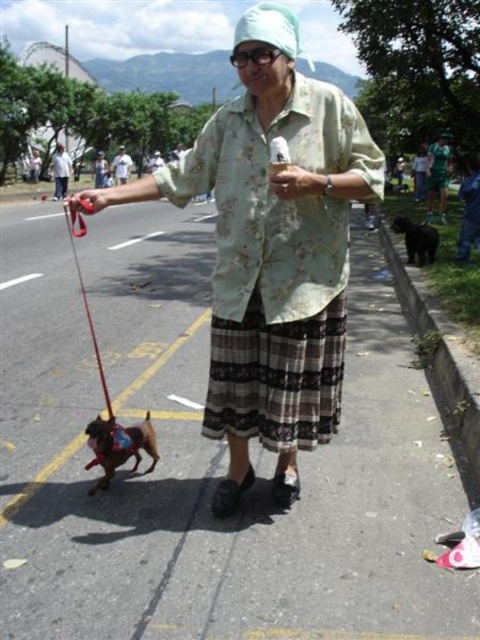
Question: Does smooth asphalt road at center lie behind black fur dog at right?

Choices:
 (A) yes
 (B) no

Answer: (B)

Question: From the image, what is the correct spatial relationship of black fur dog at right in relation to rubber leash at left?

Choices:
 (A) left
 (B) right

Answer: (B)

Question: Which object appears closest to the camera in this image?

Choices:
 (A) floral fabric shirt at center
 (B) plaid fabric skirt at center

Answer: (A)

Question: Can you confirm if smooth asphalt road at center is positioned above black fur dog at right?

Choices:
 (A) no
 (B) yes

Answer: (A)

Question: Which object is farther from the camera taking this photo?

Choices:
 (A) black fur dog at right
 (B) plaid fabric skirt at center

Answer: (A)

Question: Which point is farther from the camera taking this photo?

Choices:
 (A) (422, 264)
 (B) (233, 387)
 (C) (349, 344)

Answer: (A)